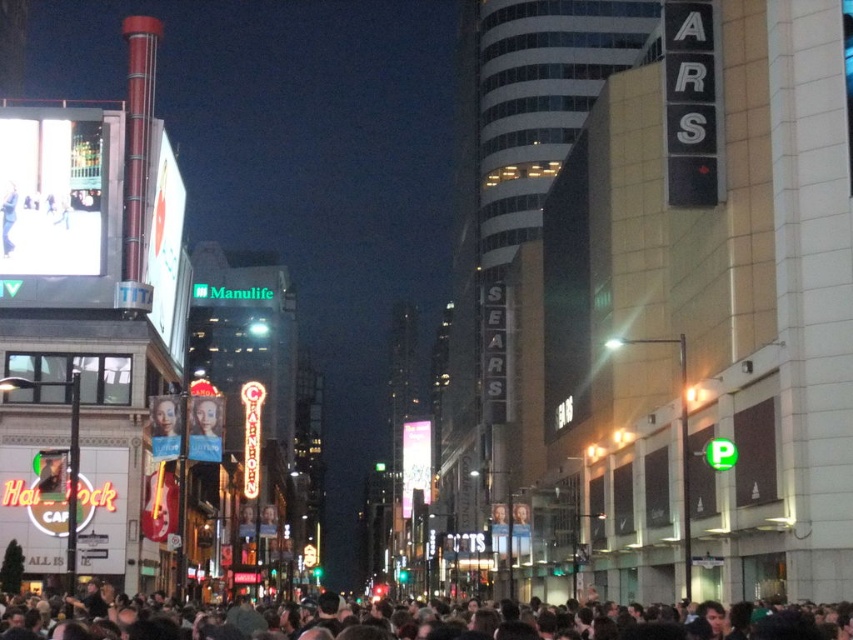
Question: Does dark brown hair at lower center appear on the right side of smooth skin face at center?

Choices:
 (A) no
 (B) yes

Answer: (B)

Question: Which point appears farthest from the camera in this image?

Choices:
 (A) (177, 403)
 (B) (379, 636)

Answer: (A)

Question: Can you confirm if dark brown hair at lower center is thinner than smooth skin face at center?

Choices:
 (A) no
 (B) yes

Answer: (A)

Question: Does dark brown hair at lower center have a smaller size compared to smooth skin face at center?

Choices:
 (A) no
 (B) yes

Answer: (A)